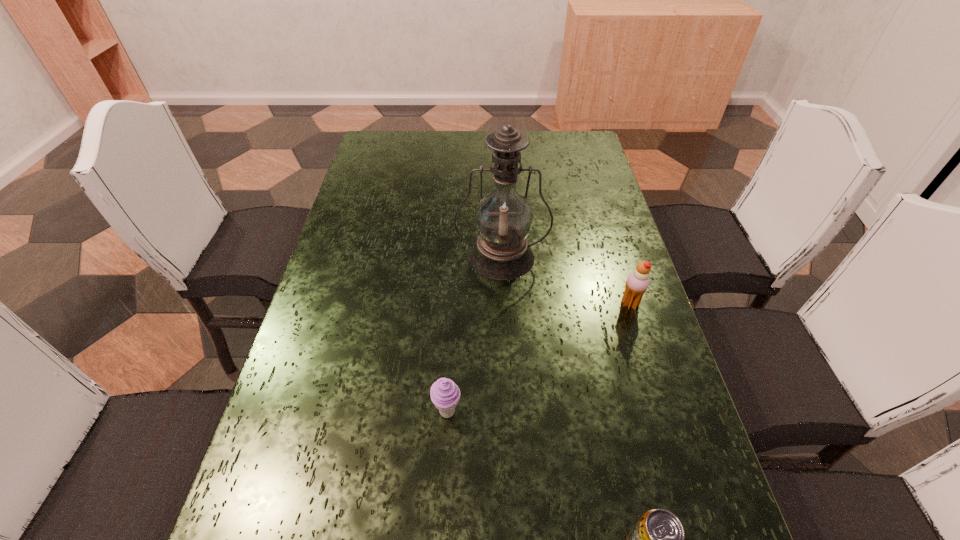
Identify the location of vacant space located 0.310m on the right of the third farthest object. (614, 413).

Where is `object that is at the right edge`? This screenshot has height=540, width=960. object that is at the right edge is located at coordinates (638, 281).

In the image, there is a desktop. What are the coordinates of `free space at the far edge` in the screenshot? It's located at (443, 132).

The height and width of the screenshot is (540, 960). In order to click on blank space at the left edge of the desktop in this screenshot , I will do tap(305, 467).

At what (x,y) coordinates should I click in order to perform the action: click on blank space at the right edge. Please return your answer as a coordinate pair (x, y). The width and height of the screenshot is (960, 540). Looking at the image, I should click on (659, 464).

The height and width of the screenshot is (540, 960). I want to click on free area in between the nearer icecream and the taller icecream, so click(x=539, y=358).

You are a GUI agent. You are given a task and a screenshot of the screen. Output one action in this format:
    pyautogui.click(x=<x>, y=<y>)
    Task: Click on the empty space between the shorter icecream and the farthest object
    The height and width of the screenshot is (540, 960).
    Given the screenshot: What is the action you would take?
    pyautogui.click(x=474, y=335)

Where is `empty space between the oil lamp and the third farthest object`? The image size is (960, 540). empty space between the oil lamp and the third farthest object is located at coordinates (474, 335).

Identify the location of vacant point located between the third shortest object and the farthest object. The width and height of the screenshot is (960, 540). (565, 280).

The width and height of the screenshot is (960, 540). Identify the location of vacant point located between the right icecream and the oil lamp. (565, 280).